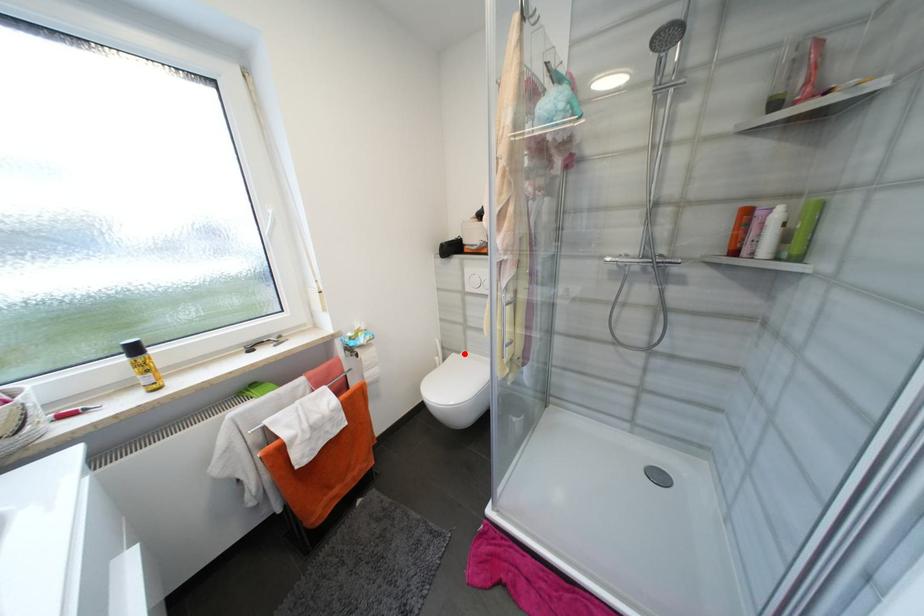
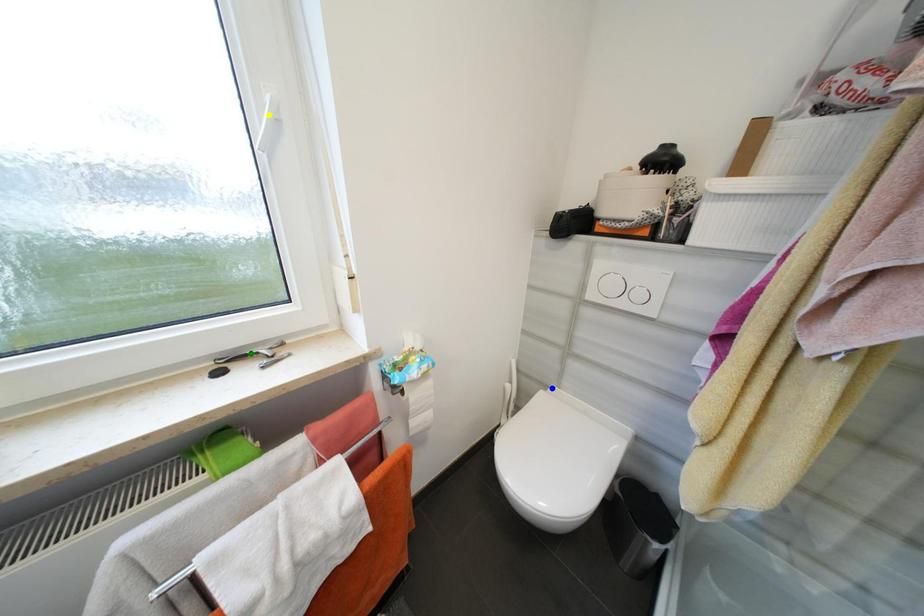
Question: I am providing you with two images of the same scene from different viewpoints. A red point is marked on the first image. You are given multiple points on the second image. Which point in image 2 is actually the same real-world point as the red point in image 1?

Choices:
 (A) green point
 (B) blue point
 (C) yellow point

Answer: (B)